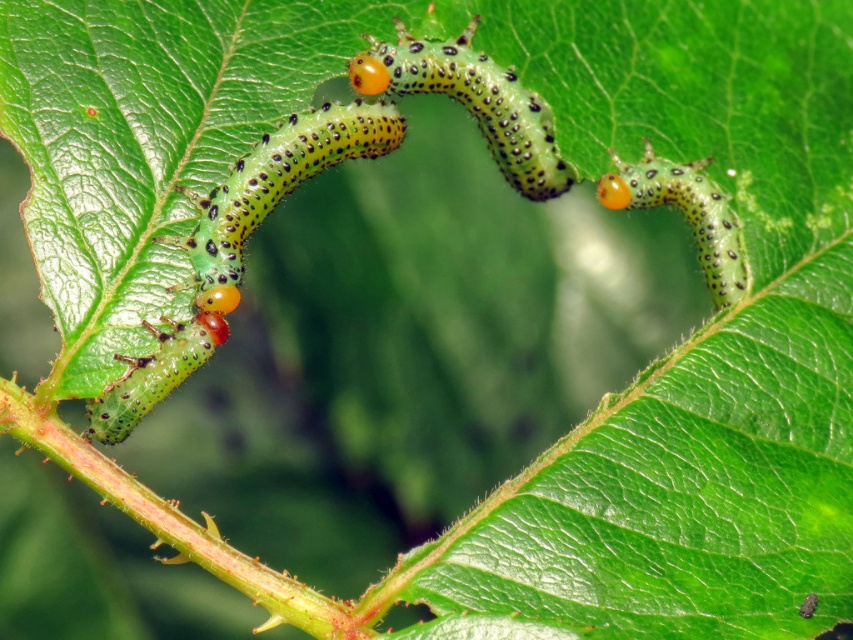
You are a biologist observing the leaf with caterpillars. You need to determine which caterpillar is taller. Which one is taller between the green matte caterpillar at left and the green speckled caterpillar at upper right?

The green matte caterpillar at left is taller than the green speckled caterpillar at upper right according to the description.

You are a gardener who wants to place a small ruler between the green matte caterpillar at left and the green spotted caterpillar at center to measure their distance. The ruler is 6 inches long. Will the ruler fit entirely between them?

The green matte caterpillar at left is 6.64 inches away from the green spotted caterpillar at center. Since the ruler is 6 inches long, it will fit entirely between them as the distance is greater than the ruler.